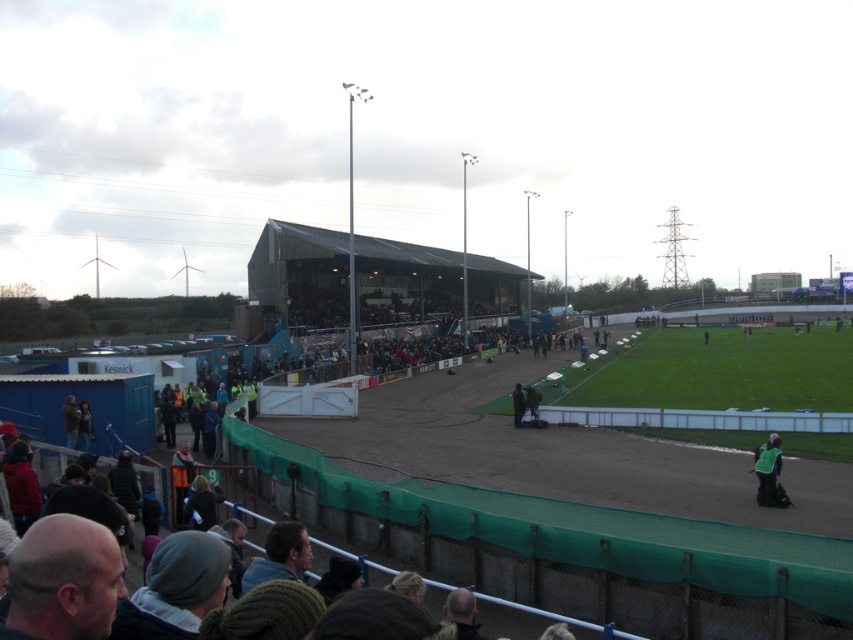
Does green reflective vest at lower right come in front of dark green fabric at center?

Yes.

Consider the image. Is green reflective vest at lower right smaller than dark green fabric at center?

No.

Between point (753, 467) and point (521, 392), which one is positioned in front?

Point (753, 467) is more forward.

I want to click on green reflective vest at lower right, so click(x=767, y=468).